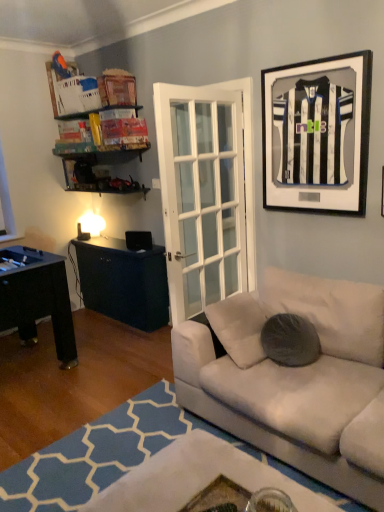
Locate an element on the screen. The image size is (384, 512). vacant space situated above white fabric couch at lower right (from a real-world perspective) is located at coordinates (82, 390).